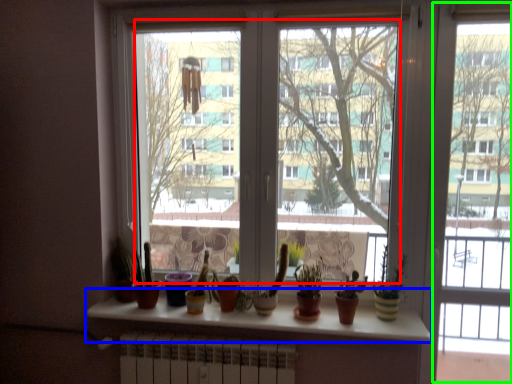
Question: Which object is positioned closest to glass window (highlighted by a red box)? Select from window sill (highlighted by a blue box) and screen door (highlighted by a green box).

Choices:
 (A) window sill
 (B) screen door

Answer: (A)